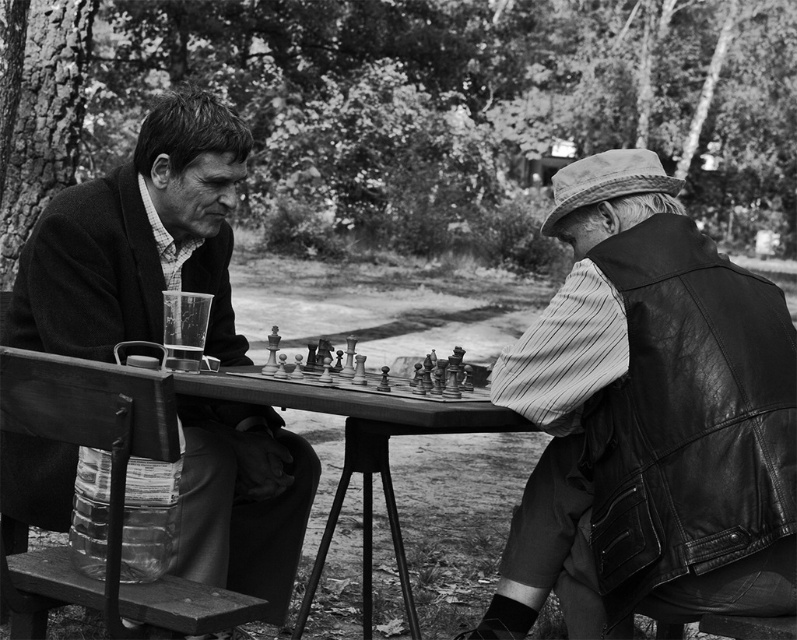
Which is in front, point (71, 225) or point (356, 460)?

Point (71, 225)

Between point (193, 422) and point (316, 401), which one is positioned in front?

Point (316, 401)

The image size is (797, 640). Identify the location of matte black jacket at left. (138, 240).

Does matte black jacket at left appear under wooden chess set at center?

Yes.

Between matte black jacket at left and wooden chess set at center, which one has more height?

Standing taller between the two is matte black jacket at left.

Which is in front, point (132, 330) or point (370, 368)?

Point (132, 330)

At what (x,y) coordinates should I click in order to perform the action: click on matte black jacket at left. Please return your answer as a coordinate pair (x, y). Image resolution: width=797 pixels, height=640 pixels. Looking at the image, I should click on (138, 240).

Can you confirm if leather vest at right is bigger than matte black jacket at left?

Actually, leather vest at right might be smaller than matte black jacket at left.

Is leather vest at right above matte black jacket at left?

Correct, leather vest at right is located above matte black jacket at left.

Between point (623, 234) and point (140, 332), which one is positioned behind?

The point (140, 332) is behind.

This screenshot has width=797, height=640. What are the coordinates of `leather vest at right` in the screenshot? It's located at (648, 419).